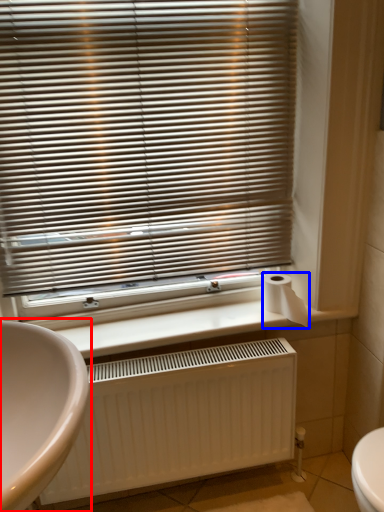
Question: Which point is further to the camera, sink (highlighted by a red box) or toilet paper (highlighted by a blue box)?

Choices:
 (A) sink
 (B) toilet paper

Answer: (B)